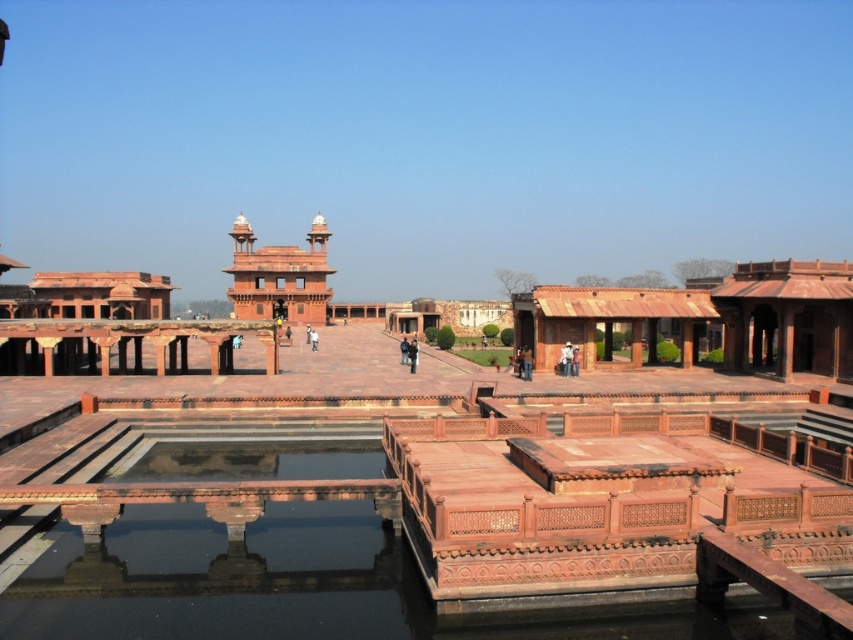
Question: Which object appears closest to the camera in this image?

Choices:
 (A) terracotta stone palace at center
 (B) smooth stone water at center

Answer: (B)

Question: Among these objects, which one is farthest from the camera?

Choices:
 (A) terracotta stone palace at center
 (B) smooth stone water at center

Answer: (A)

Question: Which point is farther to the camera?

Choices:
 (A) smooth stone water at center
 (B) terracotta stone palace at center

Answer: (B)

Question: Can you confirm if smooth stone water at center is bigger than terracotta stone palace at center?

Choices:
 (A) yes
 (B) no

Answer: (B)

Question: From the image, what is the correct spatial relationship of smooth stone water at center in relation to terracotta stone palace at center?

Choices:
 (A) above
 (B) below

Answer: (B)

Question: Observing the image, what is the correct spatial positioning of smooth stone water at center in reference to terracotta stone palace at center?

Choices:
 (A) above
 (B) below

Answer: (B)